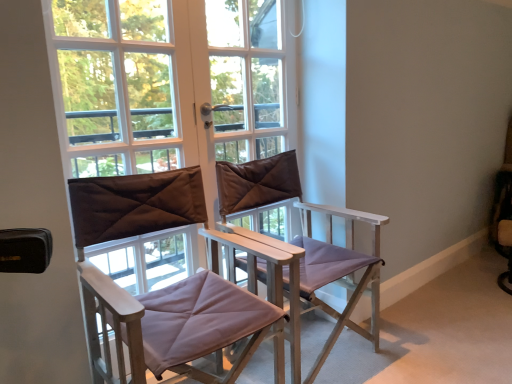
Identify the location of free point to the right of purple fabric chair at center, acting as the 1th chair starting from the right. The width and height of the screenshot is (512, 384). (432, 343).